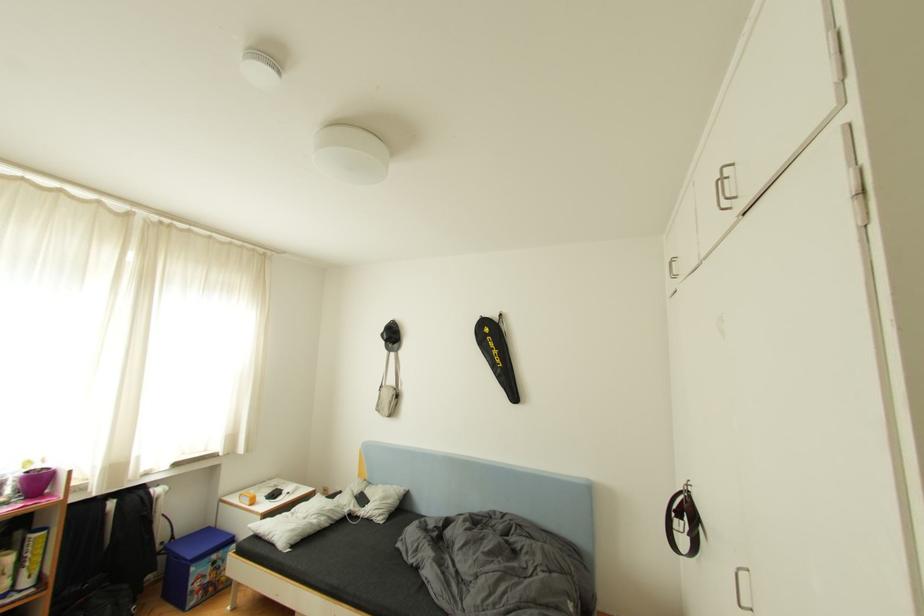
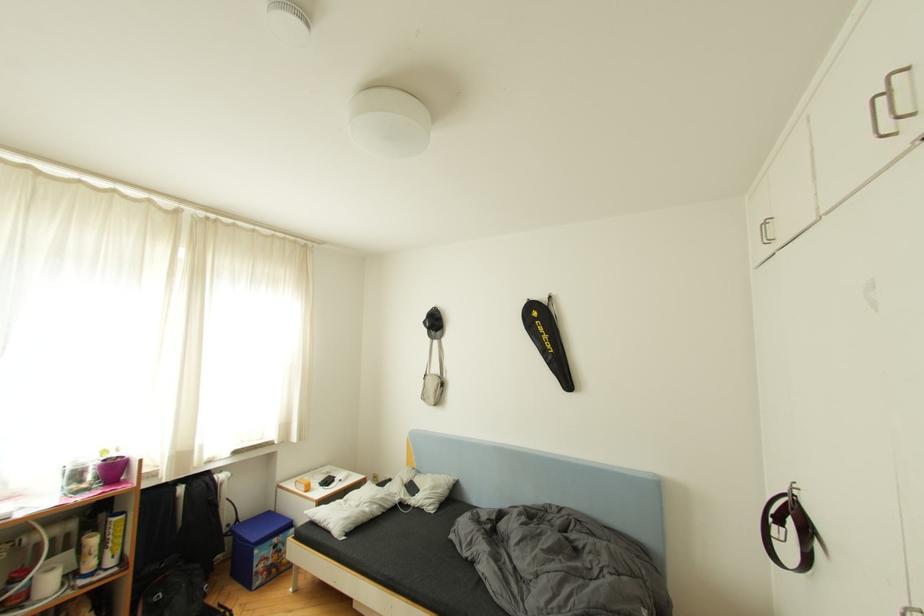
Question: The camera is either moving clockwise (left) or counter-clockwise (right) around the object. The first image is from the beginning of the video and the second image is from the end. Is the camera moving left or right when shooting the video?

Choices:
 (A) Left
 (B) Right

Answer: (B)